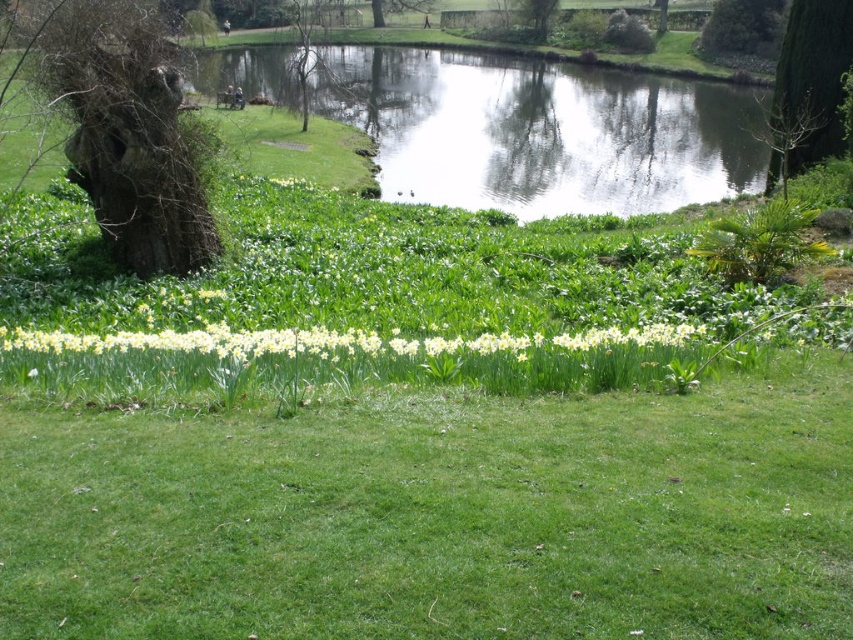
You are standing at the edge of the pond in the park and want to find the clear water at upper center. According to the coordinates provided, where should you look relative to the large tree on the left side of the pond?

The clear water at upper center is located at coordinates point (540, 131), which is to the right of the large tree on the left side of the pond.

You are standing at the point marked as point [747,3]. You want to walk to the nearest flower bed. The nearest flower bed is 105.10 meters away from you. Is this distance within a 100 meter limit for your walk?

The distance between you and the nearest flower bed is 105.10 meters, which exceeds the 100 meter limit, so you cannot reach it within the allowed distance.

You are standing at the edge of the pond in the park and see two points marked in the image. Which point is closer to you, point (779, 28) or point (544, 3)?

Point (779, 28) is in front of point (544, 3), so it is closer to you.